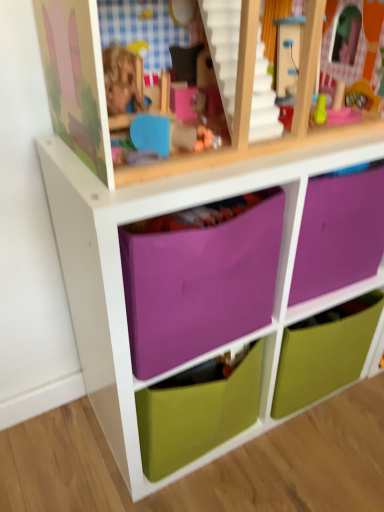
Question: Is purple fabric drawer at center, marked as the third drawer in a bottom-to-top arrangement, taller than green matte drawer at center, which is the 3th drawer in top-to-bottom order?

Choices:
 (A) no
 (B) yes

Answer: (A)

Question: Does purple fabric drawer at center, acting as the first drawer starting from the top, have a smaller size compared to green matte drawer at center, which is the 3th drawer in top-to-bottom order?

Choices:
 (A) yes
 (B) no

Answer: (B)

Question: Is purple fabric drawer at center, marked as the third drawer in a bottom-to-top arrangement, facing away from green matte drawer at center, which is the 3th drawer in top-to-bottom order?

Choices:
 (A) yes
 (B) no

Answer: (B)

Question: From the image's perspective, is purple fabric drawer at center, acting as the first drawer starting from the top, on green matte drawer at center, which appears as the first drawer when ordered from the bottom?

Choices:
 (A) no
 (B) yes

Answer: (B)

Question: Is purple fabric drawer at center, acting as the first drawer starting from the top, aimed at green matte drawer at center, which is the 3th drawer in top-to-bottom order?

Choices:
 (A) yes
 (B) no

Answer: (B)

Question: Would you say green matte drawer at center, which appears as the first drawer when ordered from the bottom, is part of purple fabric drawer at center, marked as the third drawer in a bottom-to-top arrangement,'s contents?

Choices:
 (A) yes
 (B) no

Answer: (B)

Question: From the image's perspective, is green matte drawer at center, which is the 3th drawer in top-to-bottom order, located beneath purple fabric drawer at center, acting as the second drawer starting from the bottom?

Choices:
 (A) no
 (B) yes

Answer: (B)

Question: Could you tell me if green matte drawer at center, which appears as the first drawer when ordered from the bottom, is turned towards purple fabric drawer at center, acting as the second drawer starting from the bottom?

Choices:
 (A) yes
 (B) no

Answer: (A)

Question: Can you confirm if green matte drawer at center, which appears as the first drawer when ordered from the bottom, is thinner than purple fabric drawer at center, acting as the second drawer starting from the bottom?

Choices:
 (A) no
 (B) yes

Answer: (B)

Question: Is green matte drawer at center, which is the 3th drawer in top-to-bottom order, placed right next to purple fabric drawer at center, acting as the 2th drawer starting from the top?

Choices:
 (A) no
 (B) yes

Answer: (A)

Question: Considering the relative positions of green matte drawer at center, which is the 3th drawer in top-to-bottom order, and purple fabric drawer at center, acting as the second drawer starting from the bottom, in the image provided, is green matte drawer at center, which is the 3th drawer in top-to-bottom order, to the left of purple fabric drawer at center, acting as the second drawer starting from the bottom, from the viewer's perspective?

Choices:
 (A) no
 (B) yes

Answer: (A)

Question: Does green matte drawer at center, which appears as the first drawer when ordered from the bottom, lie behind purple fabric drawer at center, acting as the 2th drawer starting from the top?

Choices:
 (A) yes
 (B) no

Answer: (A)

Question: Considering the relative sizes of purple fabric drawer at center, acting as the 2th drawer starting from the top, and green matte drawer at center, which is the 3th drawer in top-to-bottom order, in the image provided, is purple fabric drawer at center, acting as the 2th drawer starting from the top, bigger than green matte drawer at center, which is the 3th drawer in top-to-bottom order,?

Choices:
 (A) no
 (B) yes

Answer: (B)